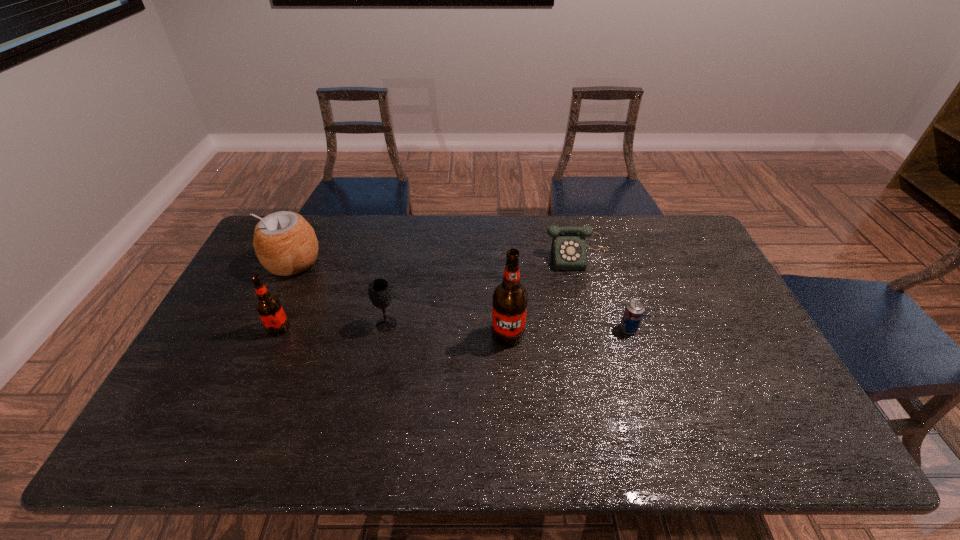
This screenshot has width=960, height=540. I want to click on free point between the beer can and the telephone, so click(x=603, y=293).

The height and width of the screenshot is (540, 960). I want to click on blank region between the beer can and the right root beer, so click(x=568, y=332).

Identify which object is the second closest to the third object from left to right. Please provide its 2D coordinates. Your answer should be formatted as a tuple, i.e. [(x, y)], where the tuple contains the x and y coordinates of a point satisfying the conditions above.

[(285, 243)]

I want to click on the closest object to the shorter root beer, so click(285, 243).

Locate an element on the screen. This screenshot has width=960, height=540. free space that satisfies the following two spatial constraints: 1. on the front side of the fourth object from left to right; 2. on the right side of the coconut is located at coordinates (260, 334).

The height and width of the screenshot is (540, 960). Identify the location of free space that satisfies the following two spatial constraints: 1. on the front side of the beer can; 2. on the right side of the coconut. (262, 329).